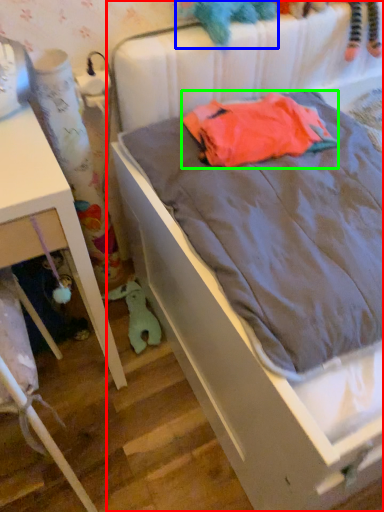
Question: Which object is the closest to the bed (highlighted by a red box)? Choose among these: toy (highlighted by a blue box) or baby clothe (highlighted by a green box).

Choices:
 (A) toy
 (B) baby clothe

Answer: (B)